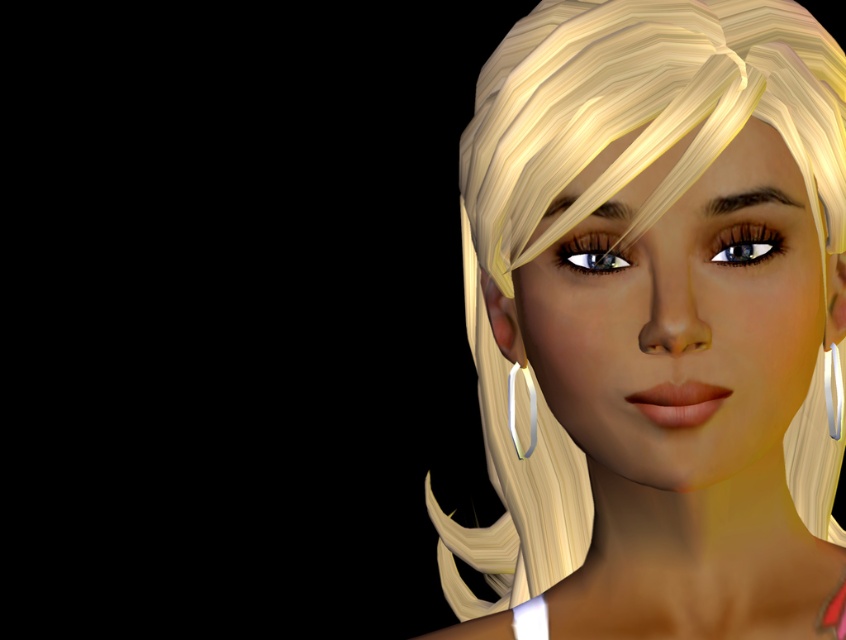
You are a photographer adjusting the lighting for a portrait. You need to ensure that the lighting focuses on the shiny blonde hair at center. Based on the scene description, where should you position the main light source relative to the point at coordinates point [656,323]?

The shiny blonde hair at center is located at point [656,323]. To focus the lighting on this area, position the main light source directly in front of this point to ensure the hair receives the most illumination.

You are a photographer adjusting the focus on your camera. You want to ensure that both the shiny brown eye at center and the shiny blue eye at center are in sharp focus. Given that the depth of field is limited, which eye should you focus on to maximize clarity for both?

You should focus on the shiny brown eye at center because it is closer to the viewer, ensuring that the shiny blue eye at center will also be in acceptable focus within the limited depth of field.

You are a photographer adjusting the lighting for a portrait. You notice the shiny blue eye at center and the silver metallic earring at right in your frame. Which object is closer to the left side of the frame?

The shiny blue eye at center is positioned on the left side of the silver metallic earring at right, so the shiny blue eye at center is closer to the left side of the frame.